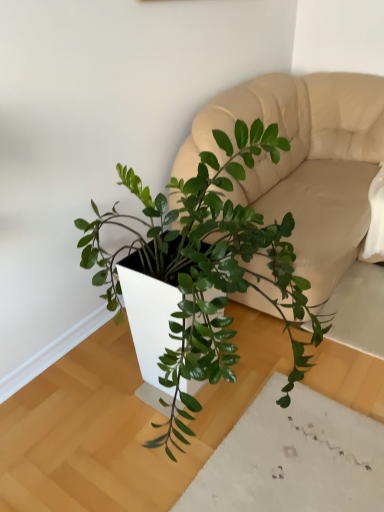
Question: From a real-world perspective, is green glossy plant at center above or below beige leather couch at center?

Choices:
 (A) above
 (B) below

Answer: (A)

Question: Considering the positions of green glossy plant at center and beige leather couch at center in the image, is green glossy plant at center bigger or smaller than beige leather couch at center?

Choices:
 (A) big
 (B) small

Answer: (B)

Question: Is point (230, 164) positioned closer to the camera than point (299, 188)?

Choices:
 (A) farther
 (B) closer

Answer: (B)

Question: From the image's perspective, is beige leather couch at center above or below green glossy plant at center?

Choices:
 (A) below
 (B) above

Answer: (B)

Question: Considering their positions, is beige leather couch at center located in front of or behind green glossy plant at center?

Choices:
 (A) behind
 (B) front

Answer: (A)

Question: In the image, is beige leather couch at center on the left side or the right side of green glossy plant at center?

Choices:
 (A) right
 (B) left

Answer: (A)

Question: Considering the positions of point (322, 75) and point (316, 342), is point (322, 75) closer or farther from the camera than point (316, 342)?

Choices:
 (A) closer
 (B) farther

Answer: (B)